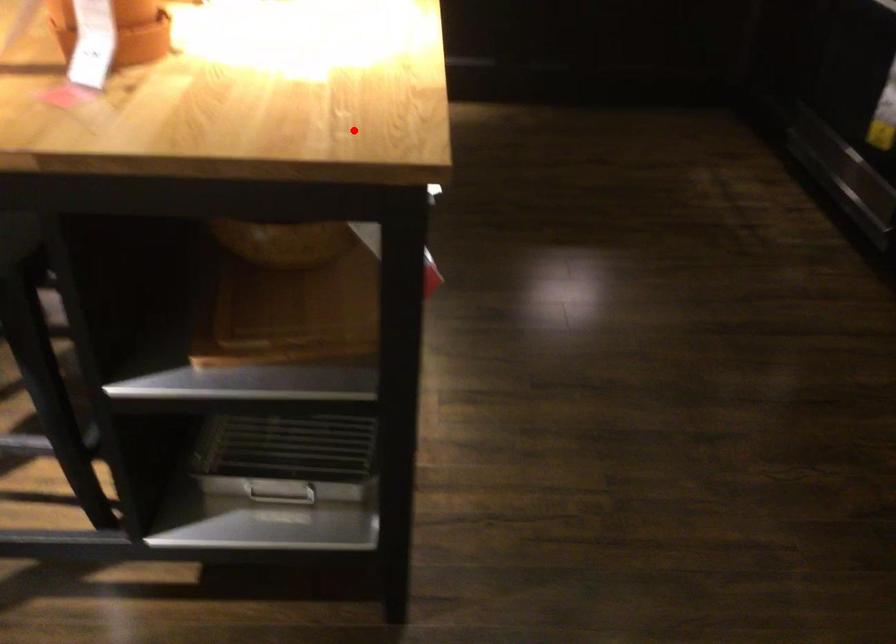
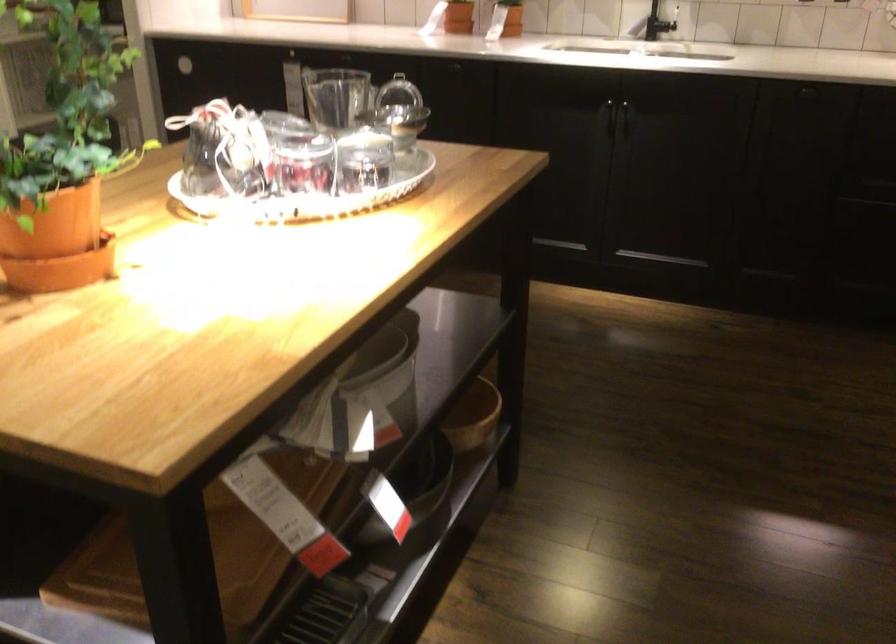
Where in the second image is the point corresponding to the highlighted location from the first image?

(135, 406)